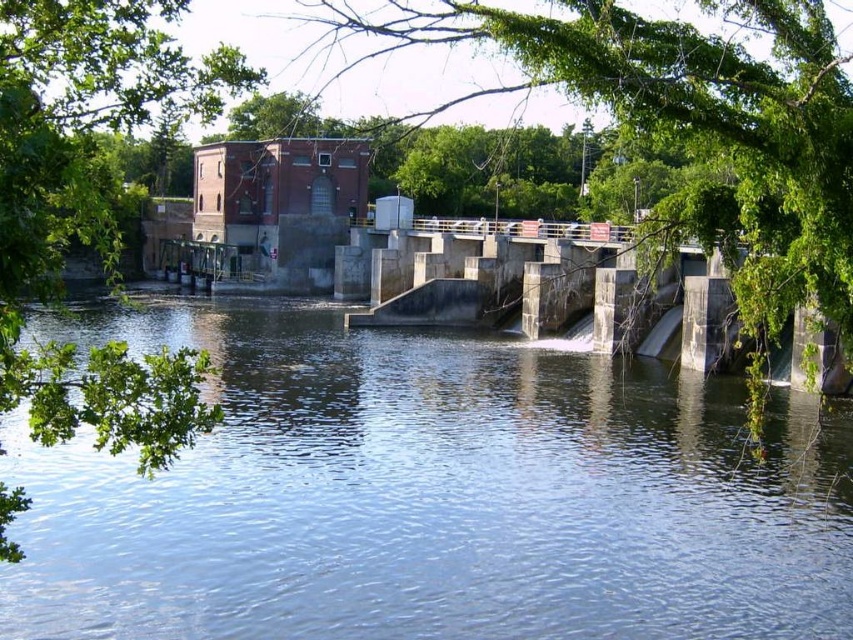
In the scene shown: You are a maintenance worker at the dam and need to inspect the clear water at center and the green leafy tree at upper center. Which object is located to the left of the other?

The clear water at center is positioned on the left side of green leafy tree at upper center, so the clear water at center is to the left of the green leafy tree at upper center.

You are a landscape photographer planning to capture the entire scene of the dam and its surroundings. You notice the clear water at center and the green leafy tree at left in your viewfinder. Which object takes up more area in the image?

The green leafy tree at left occupies more space in the image than the clear water at center according to the description.

You are standing on the walkway near the red brick building and want to take a photo of both the green leafy tree at upper center and the green leafy tree at left. Which tree should you position closer to the front of your camera frame to include both in the photo?

To include both the green leafy tree at upper center and the green leafy tree at left in the photo, position the green leafy tree at left closer to the front of your camera frame. Since the green leafy tree at upper center might be wider than the green leafy tree at left, positioning the narrower tree closer to the camera will help ensure both fit within the frame.